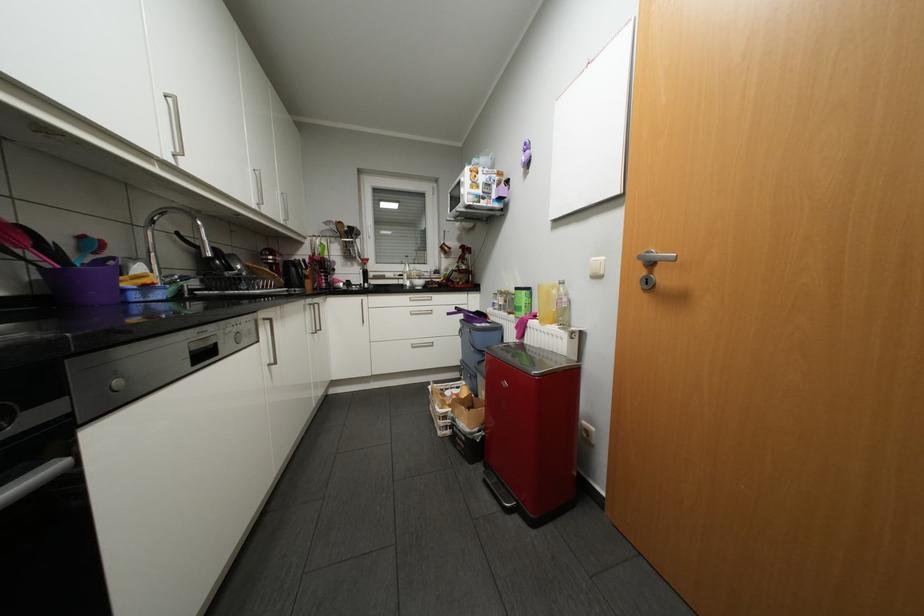
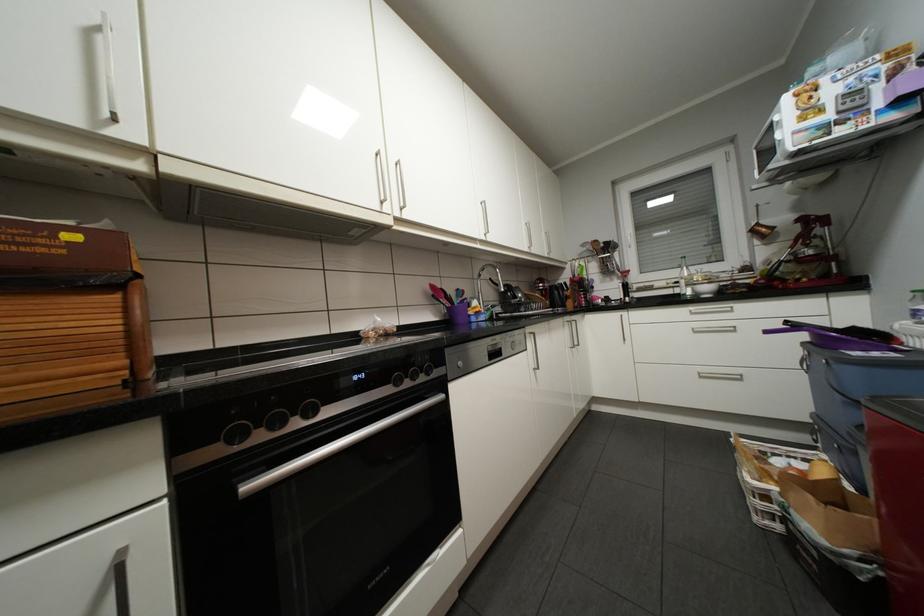
Where in the second image is the point corresponding to the point at 88,259 from the first image?

(465, 301)